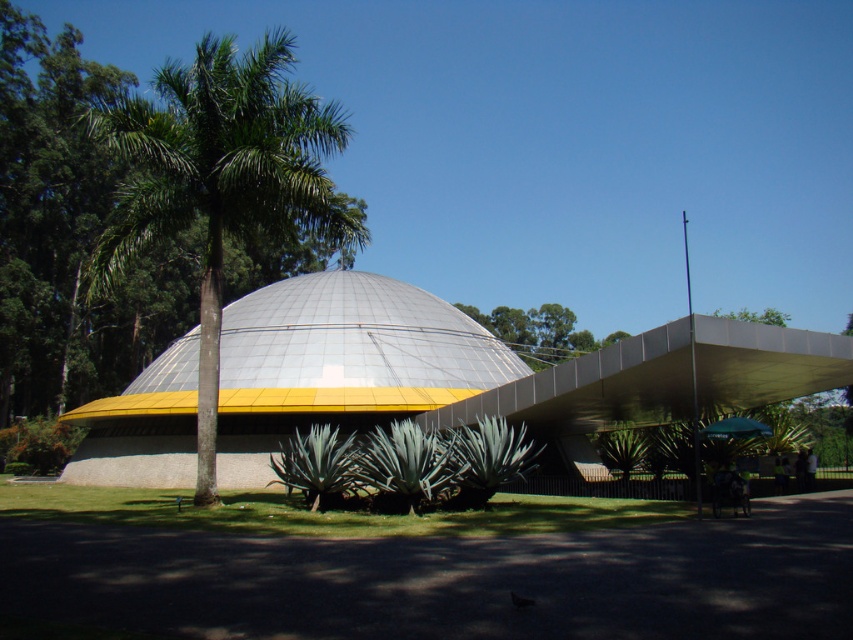
Question: Is the position of green leafy palm tree at center more distant than that of metallic dome at center?

Choices:
 (A) no
 (B) yes

Answer: (A)

Question: Which point appears closest to the camera in this image?

Choices:
 (A) (305, 412)
 (B) (115, 241)

Answer: (B)

Question: Can you confirm if green leafy palm tree at center is positioned to the left of green leafy tree at upper center?

Choices:
 (A) no
 (B) yes

Answer: (B)

Question: Among these points, which one is farthest from the camera?

Choices:
 (A) (113, 228)
 (B) (404, 348)
 (C) (526, 317)

Answer: (C)

Question: Is the position of metallic dome at center less distant than that of green leafy tree at upper center?

Choices:
 (A) yes
 (B) no

Answer: (A)

Question: Considering the real-world distances, which object is farthest from the green leafy palm tree at center?

Choices:
 (A) green leafy tree at upper center
 (B) metallic dome at center

Answer: (A)